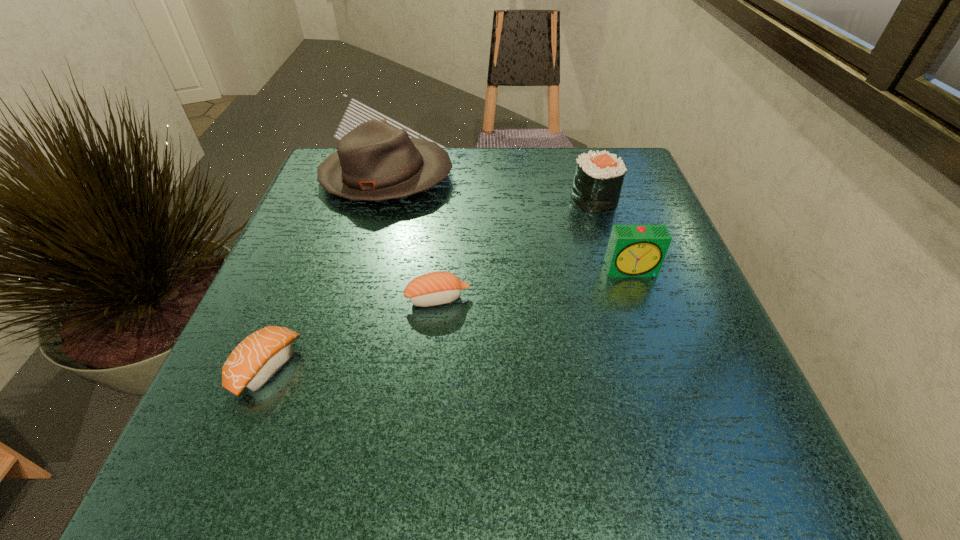
I want to click on object present at the far right corner, so click(598, 179).

Where is `vacant point at the far edge`? vacant point at the far edge is located at coordinates (531, 165).

Identify the location of vacant space at the near edge. (484, 487).

The width and height of the screenshot is (960, 540). Find the location of `free space at the left edge of the desktop`. free space at the left edge of the desktop is located at coordinates (238, 330).

The image size is (960, 540). Identify the location of free space at the right edge of the desktop. (674, 377).

In the image, there is a desktop. What are the coordinates of `free space at the near left corner` in the screenshot? It's located at (306, 435).

Identify the location of blank space at the far right corner of the desktop. This screenshot has width=960, height=540. (573, 150).

The image size is (960, 540). In order to click on vacant area at the near right corner of the desktop in this screenshot , I will do `click(688, 450)`.

Where is `blank region between the second nearest object and the nearest object`? This screenshot has width=960, height=540. blank region between the second nearest object and the nearest object is located at coordinates (352, 333).

This screenshot has width=960, height=540. I want to click on empty space between the second nearest object and the alarm clock, so click(x=535, y=285).